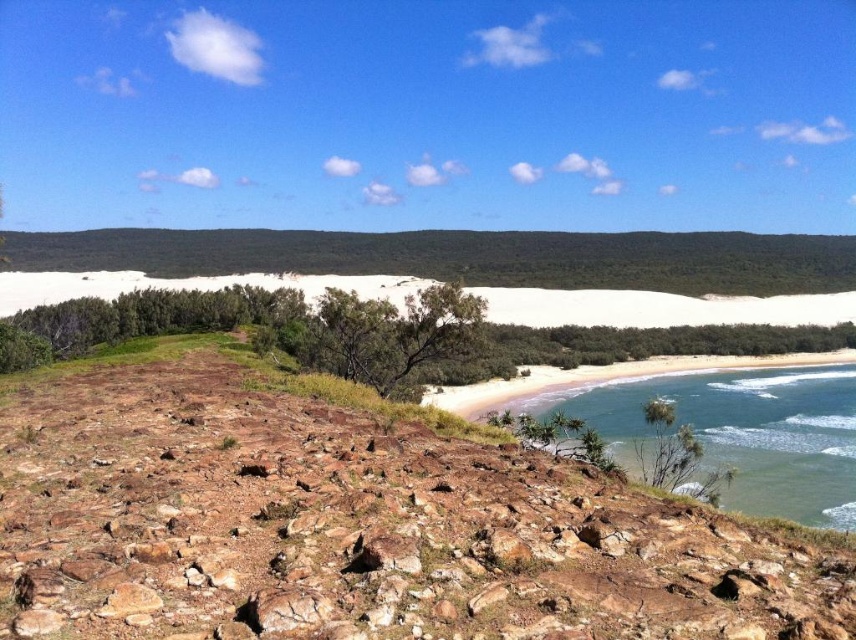
Question: Among these objects, which one is farthest from the camera?

Choices:
 (A) green grassy hillside at center
 (B) blue-green water at lower right
 (C) smooth sand beach at lower right

Answer: (A)

Question: Where is green grassy hillside at center located in relation to blue-green water at lower right in the image?

Choices:
 (A) right
 (B) left

Answer: (B)

Question: Which is nearer to the green grassy hillside at center?

Choices:
 (A) blue-green water at lower right
 (B) smooth sand beach at lower right

Answer: (B)

Question: Can you confirm if green grassy hillside at center is positioned below smooth sand beach at lower right?

Choices:
 (A) yes
 (B) no

Answer: (B)

Question: Is green grassy hillside at center thinner than smooth sand beach at lower right?

Choices:
 (A) no
 (B) yes

Answer: (A)

Question: Which object is positioned farthest from the smooth sand beach at lower right?

Choices:
 (A) green grassy hillside at center
 (B) blue-green water at lower right

Answer: (A)